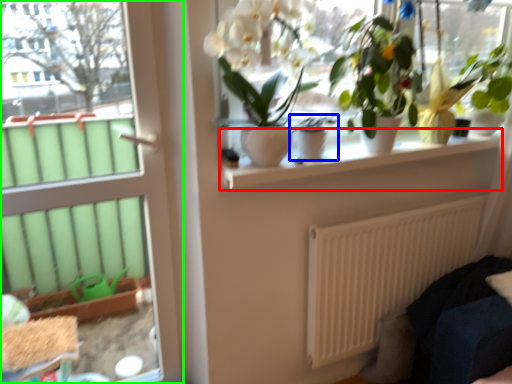
Question: Considering the real-world distances, which object is farthest from window sill (highlighted by a red box)? houseplant (highlighted by a blue box) or door (highlighted by a green box)?

Choices:
 (A) houseplant
 (B) door

Answer: (B)